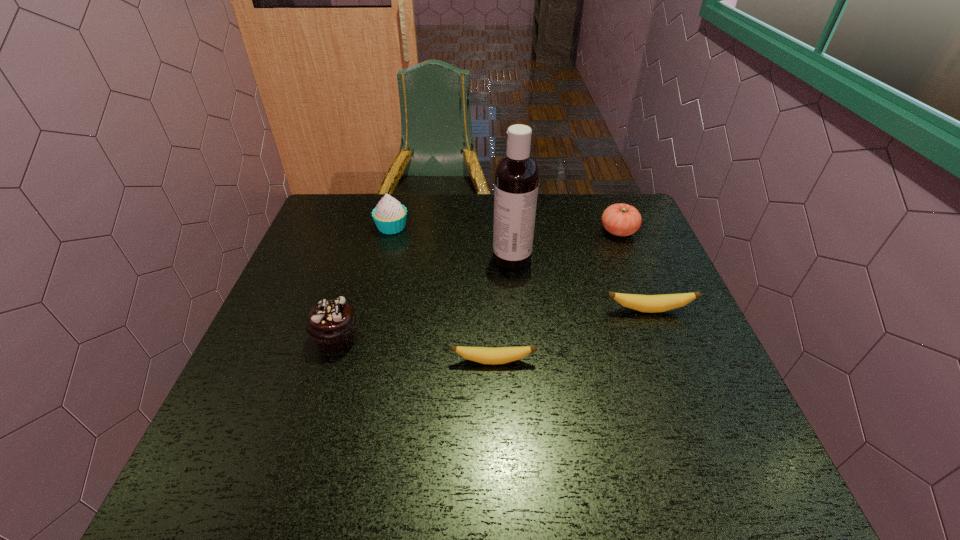
The width and height of the screenshot is (960, 540). I want to click on free space between the nearer banana and the third shortest object, so click(x=556, y=296).

The height and width of the screenshot is (540, 960). What are the coordinates of `free space between the fourth farthest object and the tomato` in the screenshot? It's located at (634, 271).

In order to click on free space between the shorter banana and the nearer cupcake in this screenshot , I will do `click(415, 349)`.

This screenshot has height=540, width=960. I want to click on vacant area between the tallest object and the taller banana, so pyautogui.click(x=581, y=284).

This screenshot has width=960, height=540. I want to click on vacant area between the dishwasher detergent and the tomato, so click(565, 245).

This screenshot has width=960, height=540. Find the location of `free spot between the fourth nearest object and the shorter banana`. free spot between the fourth nearest object and the shorter banana is located at coordinates (502, 310).

Image resolution: width=960 pixels, height=540 pixels. Identify the location of free spot between the tomato and the left banana. (556, 296).

This screenshot has height=540, width=960. Find the location of `vacant space that is in between the left banana and the nearer cupcake`. vacant space that is in between the left banana and the nearer cupcake is located at coordinates (415, 349).

Point out which object is positioned as the nearest to the farther cupcake. Please provide its 2D coordinates. Your answer should be formatted as a tuple, i.e. [(x, y)], where the tuple contains the x and y coordinates of a point satisfying the conditions above.

[(516, 183)]

Locate an element on the screen. object that is the closest to the farther cupcake is located at coordinates (516, 183).